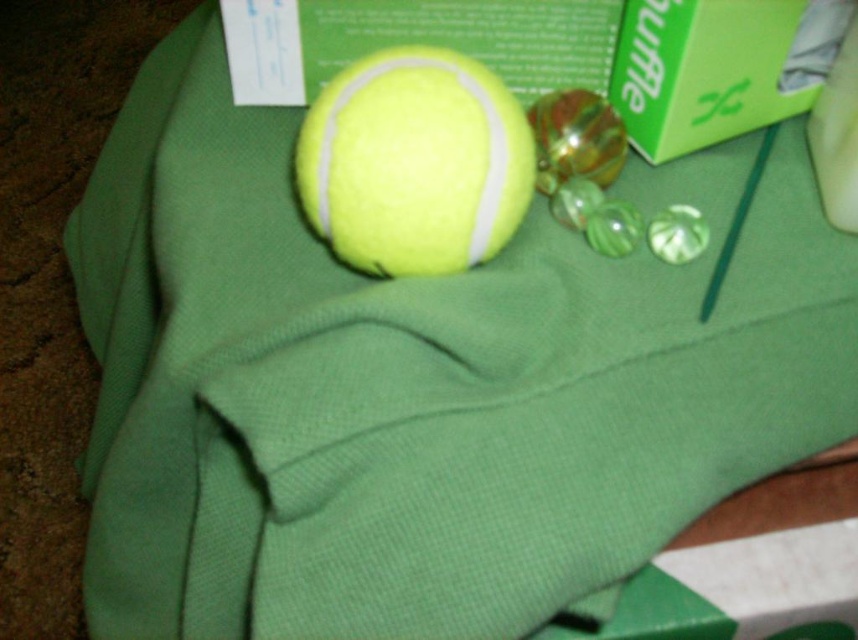
Does yellow matte tennis ball at center have a greater height compared to green cardboard box at upper right?

Indeed, yellow matte tennis ball at center has a greater height compared to green cardboard box at upper right.

Which is below, yellow matte tennis ball at center or green cardboard box at upper right?

yellow matte tennis ball at center is below.

Does point (347, 236) come farther from viewer compared to point (829, 20)?

No, (347, 236) is closer to viewer.

This screenshot has width=858, height=640. What are the coordinates of `yellow matte tennis ball at center` in the screenshot? It's located at (414, 163).